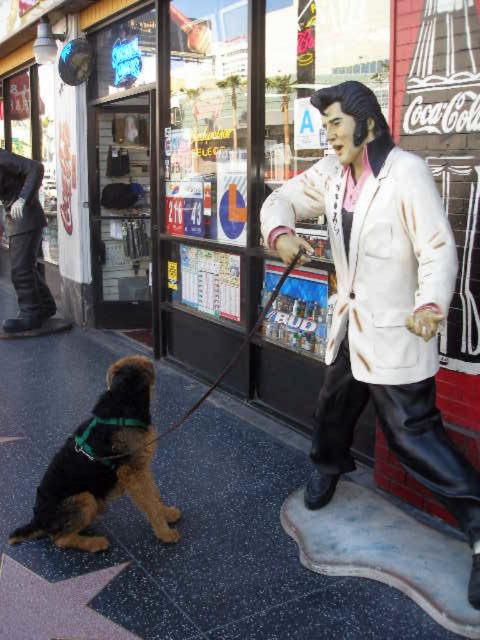
You are a customer in a store and see the white matte lab coat at center and the metallic star at lower left. Which item is closer to the entrance if the entrance is located on the left side of the store?

The metallic star at lower left is closer to the entrance because it is positioned to the left of the white matte lab coat at center.

You are a street performer who wants to set up a stage between the white matte statue at right and the black leather leash at lower left. Since the statue is taller than the leash, will the statue block the audience from seeing your performance if you place it behind the statue?

The white matte statue at right is taller than the black leather leash at lower left. If you place your performance stage behind the statue, the statue will block the audience from seeing the performance because it is taller than the leash, creating an obstruction.